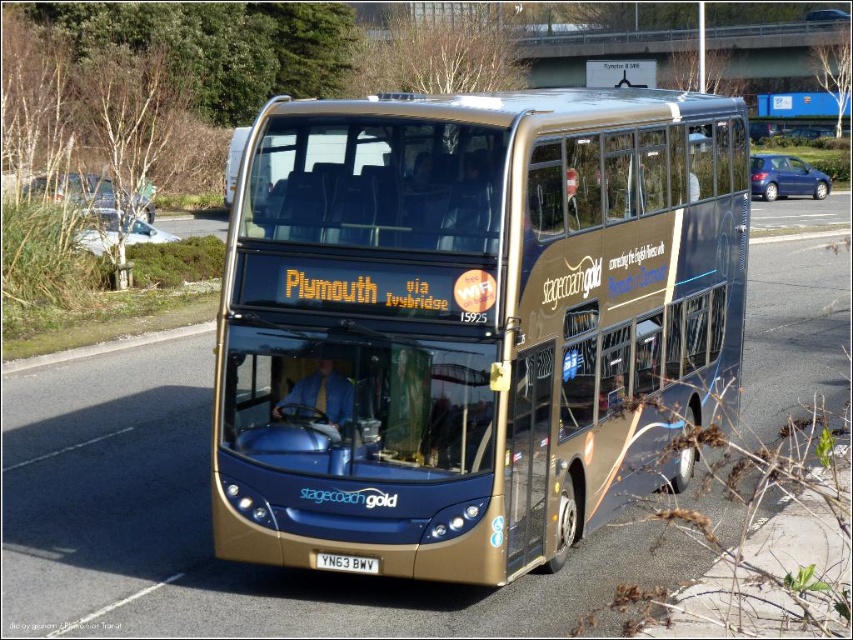
Which is below, gold metallic bus at center or red metallic license plate at center?

red metallic license plate at center is lower down.

Is gold metallic bus at center smaller than red metallic license plate at center?

No.

Between point (444, 262) and point (323, 556), which one is positioned in front?

Point (444, 262) is in front.

At what (x,y) coordinates should I click in order to perform the action: click on gold metallic bus at center. Please return your answer as a coordinate pair (x, y). Looking at the image, I should click on (473, 323).